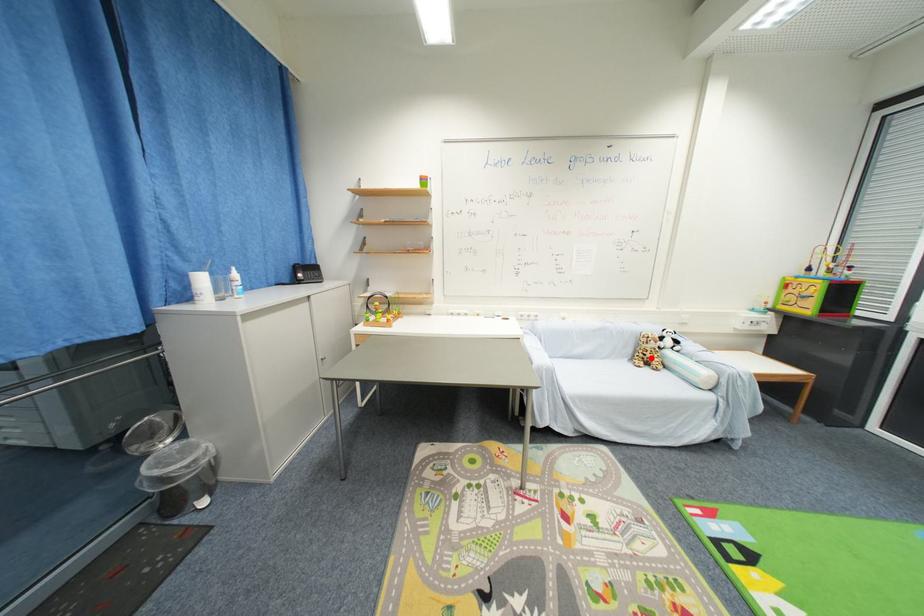
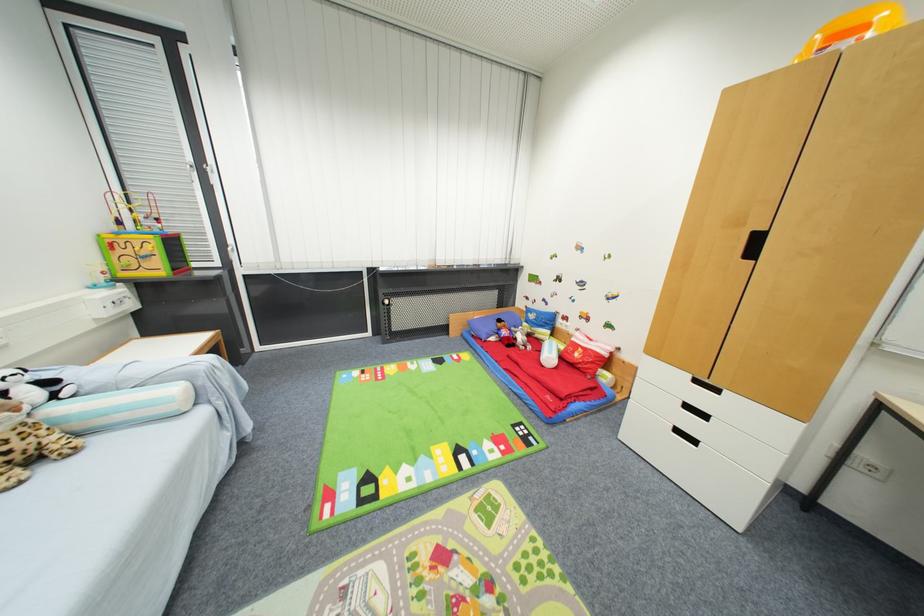
Question: I am providing you with two images of the same scene from different viewpoints. Image1 has a red point marked. In image2, the corresponding 3D location appears at what relative position? Reply with the corresponding letter.

Choices:
 (A) Closer
 (B) Farther

Answer: (B)